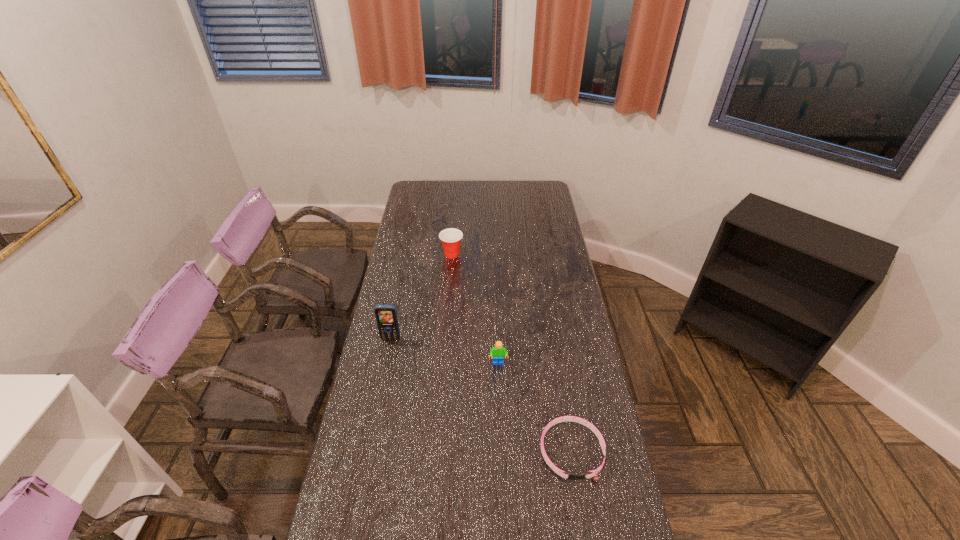
This screenshot has height=540, width=960. Identify the location of free space that is in between the cup and the third nearest object. (421, 297).

Image resolution: width=960 pixels, height=540 pixels. I want to click on free space between the leftmost object and the Lego, so click(x=444, y=351).

The height and width of the screenshot is (540, 960). I want to click on vacant space that is in between the nearest object and the farthest object, so click(x=512, y=353).

This screenshot has width=960, height=540. What are the coordinates of `blank region between the cellular telephone and the dog collar` in the screenshot? It's located at (482, 395).

Identify the location of unoccupied area between the cup and the second farthest object. This screenshot has width=960, height=540. (421, 297).

Image resolution: width=960 pixels, height=540 pixels. In order to click on blank region between the leftmost object and the dog collar in this screenshot , I will do `click(482, 395)`.

This screenshot has width=960, height=540. I want to click on vacant space that's between the leftmost object and the rightmost object, so pyautogui.click(x=482, y=395).

Image resolution: width=960 pixels, height=540 pixels. In order to click on vacant area that lies between the third object from left to right and the shortest object in this screenshot , I will do `click(536, 408)`.

Locate an element on the screen. free space between the third farthest object and the dog collar is located at coordinates (536, 408).

Locate an element on the screen. object that is the second nearest to the second object from left to right is located at coordinates (498, 352).